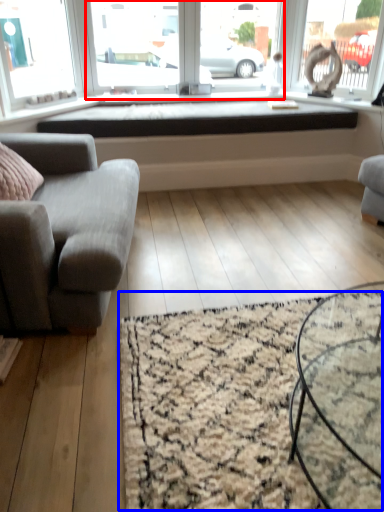
Question: Which object is further to the camera taking this photo, window screen (highlighted by a red box) or mat (highlighted by a blue box)?

Choices:
 (A) window screen
 (B) mat

Answer: (A)